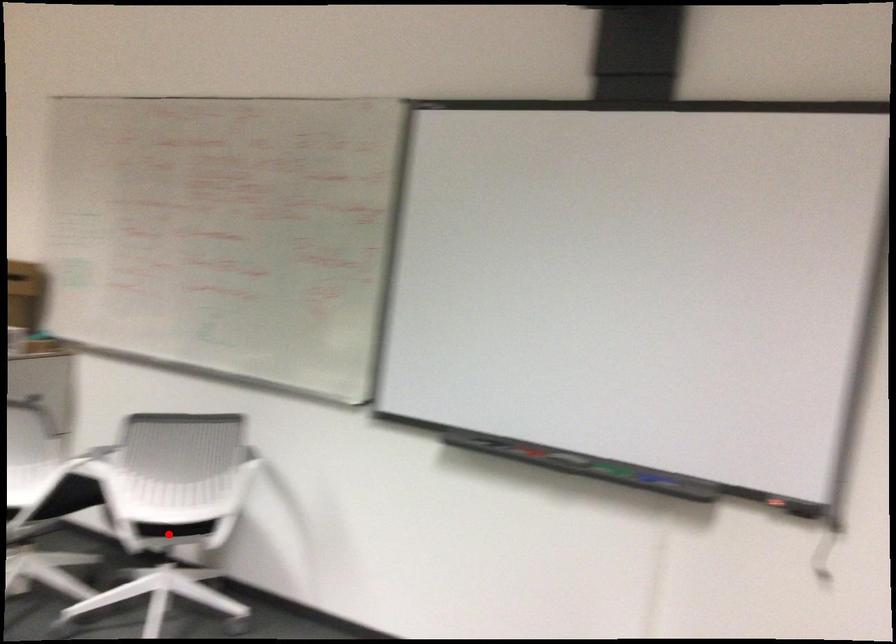
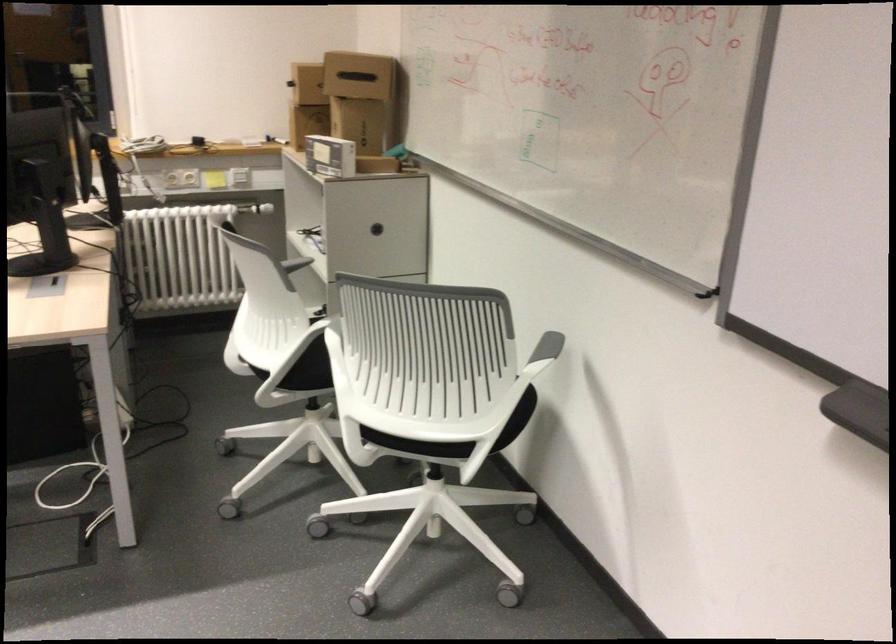
Question: I am providing you with two images of the same scene from different viewpoints. In image1, a red point is highlighted. Considering the same 3D point in image2, which of the following is correct?

Choices:
 (A) It is closer
 (B) It is farther

Answer: (A)